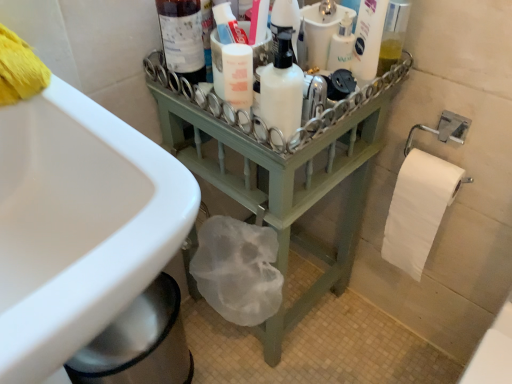
Question: In which direction should I rotate to look at white matte bottle at center, which appears as the first cleaning product when viewed from the left?

Choices:
 (A) right
 (B) left

Answer: (A)

Question: Could you tell me if white matte bottle at center, marked as the 3th cleaning product in a right-to-left arrangement, is facing translucent plastic bottle at upper center, marked as the 2th cleaning product in a left-to-right arrangement?

Choices:
 (A) yes
 (B) no

Answer: (B)

Question: Considering the relative sizes of white matte bottle at center, marked as the 3th cleaning product in a right-to-left arrangement, and translucent plastic bottle at upper center, acting as the 2th cleaning product starting from the right, in the image provided, is white matte bottle at center, marked as the 3th cleaning product in a right-to-left arrangement, bigger than translucent plastic bottle at upper center, acting as the 2th cleaning product starting from the right,?

Choices:
 (A) no
 (B) yes

Answer: (A)

Question: Can you confirm if white matte bottle at center, which appears as the first cleaning product when viewed from the left, is taller than translucent plastic bottle at upper center, acting as the 2th cleaning product starting from the right?

Choices:
 (A) yes
 (B) no

Answer: (A)

Question: Is white matte bottle at center, which appears as the first cleaning product when viewed from the left, not within translucent plastic bottle at upper center, acting as the 2th cleaning product starting from the right?

Choices:
 (A) no
 (B) yes

Answer: (B)

Question: Can translucent plastic bottle at upper center, marked as the 2th cleaning product in a left-to-right arrangement, be found inside white matte bottle at center, marked as the 3th cleaning product in a right-to-left arrangement?

Choices:
 (A) yes
 (B) no

Answer: (B)

Question: Does white matte bottle at center, marked as the 3th cleaning product in a right-to-left arrangement, come in front of translucent plastic bottle at upper center, acting as the 2th cleaning product starting from the right?

Choices:
 (A) yes
 (B) no

Answer: (A)

Question: Is white glossy lotion at upper right, which is the 1th cleaning product in right-to-left order, facing away from white matte bottle at center, marked as the 3th cleaning product in a right-to-left arrangement?

Choices:
 (A) no
 (B) yes

Answer: (A)

Question: Is white glossy lotion at upper right, the 3th cleaning product in the left-to-right sequence, wider than white matte bottle at center, marked as the 3th cleaning product in a right-to-left arrangement?

Choices:
 (A) no
 (B) yes

Answer: (A)

Question: Considering the relative sizes of white glossy lotion at upper right, the 3th cleaning product in the left-to-right sequence, and white matte bottle at center, marked as the 3th cleaning product in a right-to-left arrangement, in the image provided, is white glossy lotion at upper right, the 3th cleaning product in the left-to-right sequence, smaller than white matte bottle at center, marked as the 3th cleaning product in a right-to-left arrangement,?

Choices:
 (A) yes
 (B) no

Answer: (B)

Question: Can you confirm if white glossy lotion at upper right, which is the 1th cleaning product in right-to-left order, is thinner than white matte bottle at center, marked as the 3th cleaning product in a right-to-left arrangement?

Choices:
 (A) no
 (B) yes

Answer: (B)

Question: Could you tell me if white glossy lotion at upper right, which is the 1th cleaning product in right-to-left order, is turned towards white matte bottle at center, marked as the 3th cleaning product in a right-to-left arrangement?

Choices:
 (A) yes
 (B) no

Answer: (B)

Question: Does white glossy lotion at upper right, the 3th cleaning product in the left-to-right sequence, come in front of white matte bottle at center, which appears as the first cleaning product when viewed from the left?

Choices:
 (A) yes
 (B) no

Answer: (B)

Question: Does green painted wood at center turn towards matte glass bottle at upper center?

Choices:
 (A) yes
 (B) no

Answer: (B)